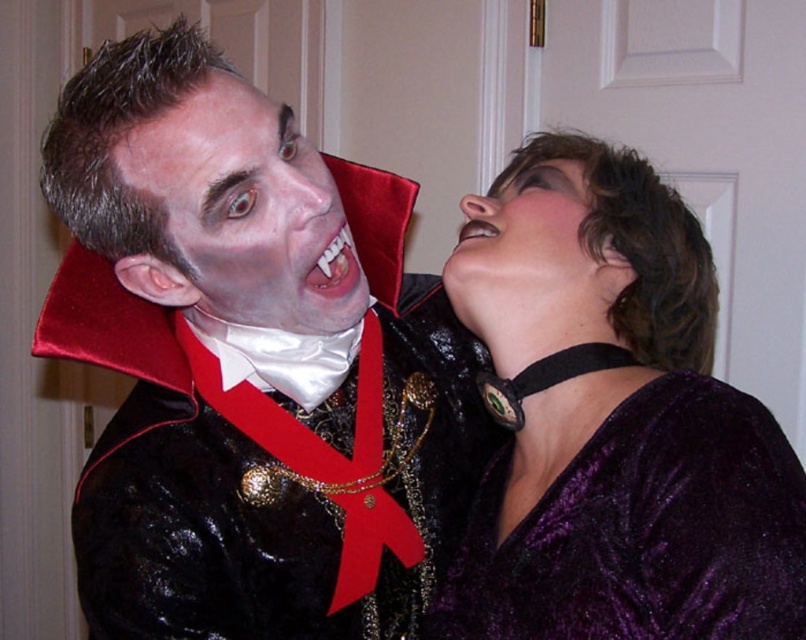
Question: Which point appears closest to the camera in this image?

Choices:
 (A) (491, 228)
 (B) (680, 572)
 (C) (308, 284)

Answer: (B)

Question: Does velvet black jacket at center appear over pink glossy lips at upper center?

Choices:
 (A) no
 (B) yes

Answer: (A)

Question: Which is farther from the white glossy teeth at center?

Choices:
 (A) velvet purple choker at upper right
 (B) purple velvet face at upper right
 (C) pink glossy lips at upper center
 (D) gray matte face at upper center

Answer: (A)

Question: Which point is closer to the camera taking this photo?

Choices:
 (A) (634, 468)
 (B) (226, 260)
 (C) (546, 186)

Answer: (A)

Question: Does velvet black jacket at center come behind gray matte face at upper center?

Choices:
 (A) yes
 (B) no

Answer: (A)

Question: Does velvet purple choker at upper right have a lesser width compared to pink glossy lips at upper center?

Choices:
 (A) no
 (B) yes

Answer: (A)